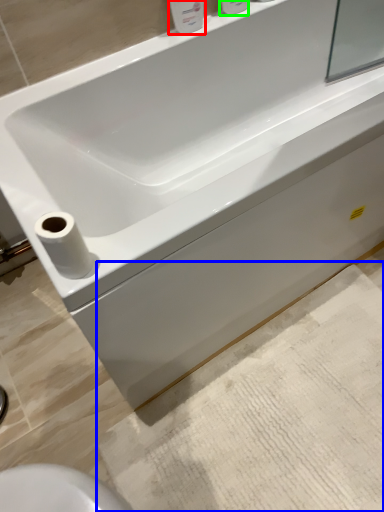
Question: Which object is positioned farthest from toiletry (highlighted by a red box)? Select from bath mat (highlighted by a blue box) and toiletry (highlighted by a green box).

Choices:
 (A) bath mat
 (B) toiletry

Answer: (A)